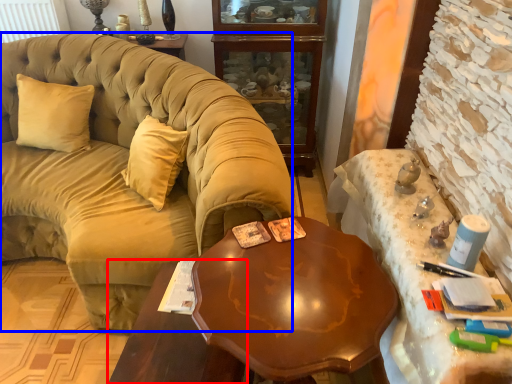
Question: Which object is closer to the camera taking this photo, table (highlighted by a red box) or studio couch (highlighted by a blue box)?

Choices:
 (A) table
 (B) studio couch

Answer: (A)